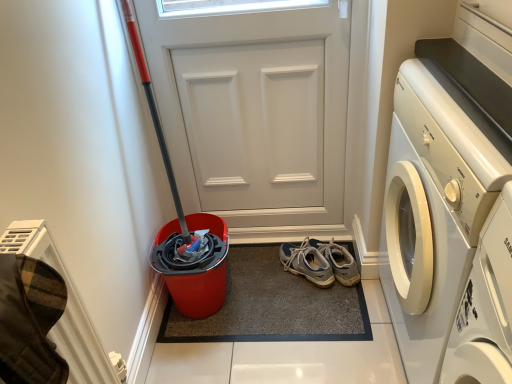
Where is `white glossy washing machine at right`? This screenshot has width=512, height=384. white glossy washing machine at right is located at coordinates (433, 213).

Where is `white glossy washing machine at right`? white glossy washing machine at right is located at coordinates (433, 213).

Between white matte door at center and light blue suede sneakers at center, which one appears on the right side from the viewer's perspective?

light blue suede sneakers at center is more to the right.

Could you tell me if white matte door at center is facing light blue suede sneakers at center?

Yes, white matte door at center is oriented towards light blue suede sneakers at center.

Considering the sizes of carpeted mat at center and white matte door at center in the image, is carpeted mat at center taller or shorter than white matte door at center?

In the image, carpeted mat at center appears to be shorter than white matte door at center.

Could you tell me if carpeted mat at center is turned towards white matte door at center?

No, carpeted mat at center is not facing towards white matte door at center.

From the image's perspective, would you say carpeted mat at center is positioned over white matte door at center?

No, from the image's perspective, carpeted mat at center is not on top of white matte door at center.

From a real-world perspective, is carpeted mat at center on top of white matte door at center?

Actually, carpeted mat at center is physically below white matte door at center in the real world.

Is white matte door at center at the back of white glossy washing machine at right?

white glossy washing machine at right is not turned away from white matte door at center.

Considering the relative sizes of white glossy washing machine at right and white matte door at center in the image provided, is white glossy washing machine at right thinner than white matte door at center?

No.

Is carpeted mat at center inside or outside of white glossy washing machine at right?

carpeted mat at center lies outside white glossy washing machine at right.

Considering the positions of objects carpeted mat at center and white glossy washing machine at right in the image provided, who is behind, carpeted mat at center or white glossy washing machine at right?

carpeted mat at center.

From a real-world perspective, who is located lower, carpeted mat at center or white glossy washing machine at right?

In real-world perspective, carpeted mat at center is lower.

Which is more to the right, white glossy washing machine at right or carpeted mat at center?

white glossy washing machine at right is more to the right.

At what (x,y) coordinates should I click in order to perform the action: click on doormat located behind the white glossy washing machine at right. Please return your answer as a coordinate pair (x, y). The width and height of the screenshot is (512, 384). Looking at the image, I should click on (272, 306).

From the image's perspective, does white glossy washing machine at right appear lower than carpeted mat at center?

No.

How far apart are white glossy washing machine at right and carpeted mat at center?

The distance of white glossy washing machine at right from carpeted mat at center is 56.18 centimeters.

Which point is more forward, (228,333) or (315,252)?

Positioned in front is point (228,333).

Based on the photo, are carpeted mat at center and light blue suede sneakers at center beside each other?

carpeted mat at center and light blue suede sneakers at center are not in contact.

From the image's perspective, does carpeted mat at center appear lower than light blue suede sneakers at center?

Indeed, from the image's perspective, carpeted mat at center is shown beneath light blue suede sneakers at center.

From a real-world perspective, is carpeted mat at center on light blue suede sneakers at center?

No, from a real-world perspective, carpeted mat at center is not on top of light blue suede sneakers at center.

From a real-world perspective, which is physically below, light blue suede sneakers at center or carpeted mat at center?

From a 3D spatial view, carpeted mat at center is below.

What's the angular difference between light blue suede sneakers at center and carpeted mat at center's facing directions?

light blue suede sneakers at center and carpeted mat at center are facing 40.9 degrees away from each other.

Is light blue suede sneakers at center wider than carpeted mat at center?

No, light blue suede sneakers at center is not wider than carpeted mat at center.

Locate an element on the screen. This screenshot has height=384, width=512. footwear that appears on the right of white matte door at center is located at coordinates (307, 263).

You are a GUI agent. You are given a task and a screenshot of the screen. Output one action in this format:
    pyautogui.click(x=<x>, y=<y>)
    Task: Click on the door above the carpeted mat at center (from the image's perspective)
    The height and width of the screenshot is (384, 512).
    Given the screenshot: What is the action you would take?
    pyautogui.click(x=254, y=110)

When comparing their distances from light blue suede sneakers at center, does white glossy washing machine at right or carpeted mat at center seem further?

Based on the image, white glossy washing machine at right appears to be further to light blue suede sneakers at center.

Looking at the image, which one is located closer to white glossy washing machine at right, white matte door at center or light blue suede sneakers at center?

The object closer to white glossy washing machine at right is light blue suede sneakers at center.

Looking at the image, which one is located closer to light blue suede sneakers at center, carpeted mat at center or white matte door at center?

carpeted mat at center.

When comparing their distances from white matte door at center, does carpeted mat at center or white glossy washing machine at right seem further?

Among the two, white glossy washing machine at right is located further to white matte door at center.

When comparing their distances from carpeted mat at center, does white glossy washing machine at right or light blue suede sneakers at center seem closer?

light blue suede sneakers at center is closer to carpeted mat at center.

Looking at the image, which one is located closer to white glossy washing machine at right, light blue suede sneakers at center or carpeted mat at center?

carpeted mat at center lies closer to white glossy washing machine at right than the other object.

When comparing their distances from white matte door at center, does light blue suede sneakers at center or white glossy washing machine at right seem closer?

Among the two, light blue suede sneakers at center is located nearer to white matte door at center.

Estimate the real-world distances between objects in this image. Which object is further from carpeted mat at center, white matte door at center or light blue suede sneakers at center?

white matte door at center lies further to carpeted mat at center than the other object.

Locate an element on the screen. doormat positioned between white glossy washing machine at right and light blue suede sneakers at center from near to far is located at coordinates (272, 306).

You are a GUI agent. You are given a task and a screenshot of the screen. Output one action in this format:
    pyautogui.click(x=<x>, y=<y>)
    Task: Click on the door located between white glossy washing machine at right and carpeted mat at center in the depth direction
    
    Given the screenshot: What is the action you would take?
    pyautogui.click(x=254, y=110)

Identify the location of door between white glossy washing machine at right and light blue suede sneakers at center in the front-back direction. The image size is (512, 384). click(x=254, y=110).

The width and height of the screenshot is (512, 384). Identify the location of footwear that lies between white matte door at center and carpeted mat at center from top to bottom. (307, 263).